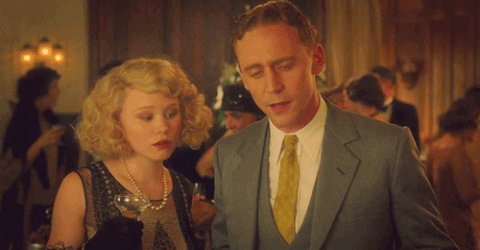
You are a GUI agent. You are given a task and a screenshot of the screen. Output one action in this format:
    pyautogui.click(x=<x>, y=<y>)
    Task: Click on the pink drapes
    The height and width of the screenshot is (250, 480).
    Given the screenshot: What is the action you would take?
    pyautogui.click(x=440, y=38)